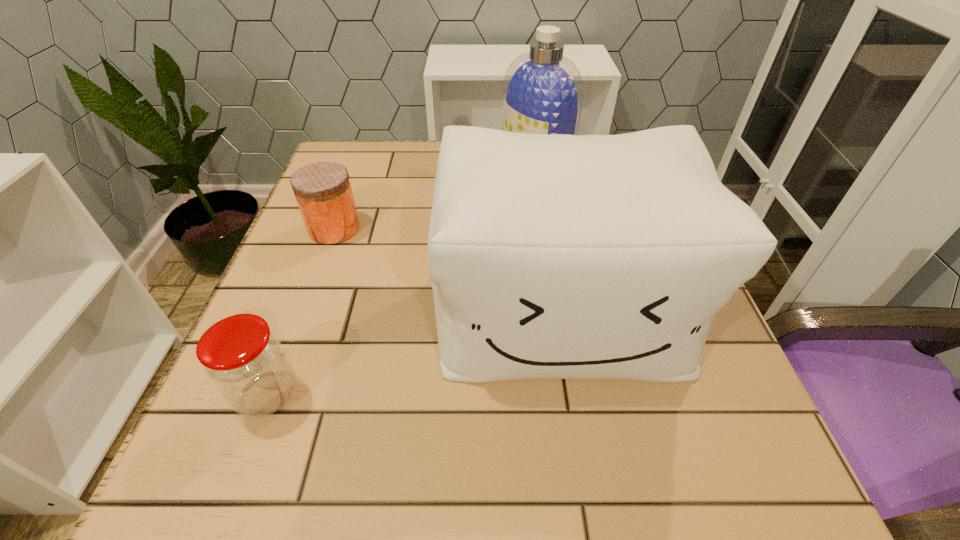
Locate an element on the screen. free space between the nearer jar and the cushion is located at coordinates (414, 353).

Locate an element on the screen. vacant space in between the farther jar and the nearer jar is located at coordinates (300, 312).

Locate an element on the screen. Image resolution: width=960 pixels, height=540 pixels. vacant region between the farther jar and the nearer jar is located at coordinates (300, 312).

This screenshot has height=540, width=960. I want to click on object that is the second nearest to the farther jar, so click(243, 358).

Select which object is the closest to the farthest object. Please provide its 2D coordinates. Your answer should be formatted as a tuple, i.e. [(x, y)], where the tuple contains the x and y coordinates of a point satisfying the conditions above.

[(559, 256)]

Locate an element on the screen. The width and height of the screenshot is (960, 540). vacant space that satisfies the following two spatial constraints: 1. on the back side of the nearer jar; 2. on the left side of the farthest object is located at coordinates (354, 165).